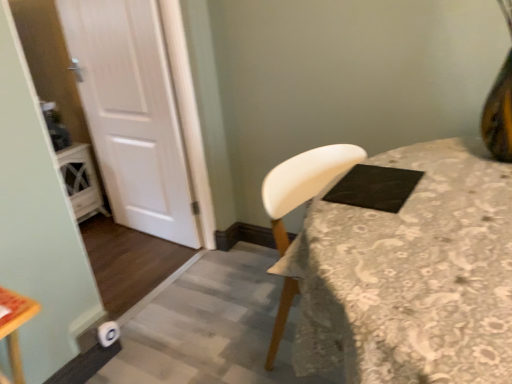
Question: From a real-world perspective, does black matte pad at upper right stand above white wood door at left?

Choices:
 (A) yes
 (B) no

Answer: (A)

Question: Would you consider black matte pad at upper right to be distant from white wood door at left?

Choices:
 (A) yes
 (B) no

Answer: (A)

Question: Is black matte pad at upper right at the left side of white wood door at left?

Choices:
 (A) yes
 (B) no

Answer: (B)

Question: Can you confirm if black matte pad at upper right is wider than white wood door at left?

Choices:
 (A) no
 (B) yes

Answer: (B)

Question: Can you confirm if black matte pad at upper right is shorter than white wood door at left?

Choices:
 (A) yes
 (B) no

Answer: (A)

Question: In terms of size, does white fabric-covered table at center appear bigger or smaller than black matte pad at upper right?

Choices:
 (A) small
 (B) big

Answer: (B)

Question: In terms of width, does white fabric-covered table at center look wider or thinner when compared to black matte pad at upper right?

Choices:
 (A) thin
 (B) wide

Answer: (B)

Question: Choose the correct answer: Is white fabric-covered table at center inside black matte pad at upper right or outside it?

Choices:
 (A) inside
 (B) outside

Answer: (B)

Question: In the image, is white fabric-covered table at center on the left side or the right side of black matte pad at upper right?

Choices:
 (A) left
 (B) right

Answer: (A)

Question: Is point (395, 203) positioned closer to the camera than point (90, 117)?

Choices:
 (A) farther
 (B) closer

Answer: (B)

Question: Considering the positions of black matte pad at upper right and white wood door at left in the image, is black matte pad at upper right wider or thinner than white wood door at left?

Choices:
 (A) wide
 (B) thin

Answer: (A)

Question: In the image, is black matte pad at upper right on the left side or the right side of white wood door at left?

Choices:
 (A) right
 (B) left

Answer: (A)

Question: From their relative heights in the image, would you say black matte pad at upper right is taller or shorter than white wood door at left?

Choices:
 (A) tall
 (B) short

Answer: (B)

Question: Considering their positions, is white fabric-covered table at center located in front of or behind white wood door at left?

Choices:
 (A) front
 (B) behind

Answer: (A)

Question: From their relative heights in the image, would you say white fabric-covered table at center is taller or shorter than white wood door at left?

Choices:
 (A) short
 (B) tall

Answer: (A)